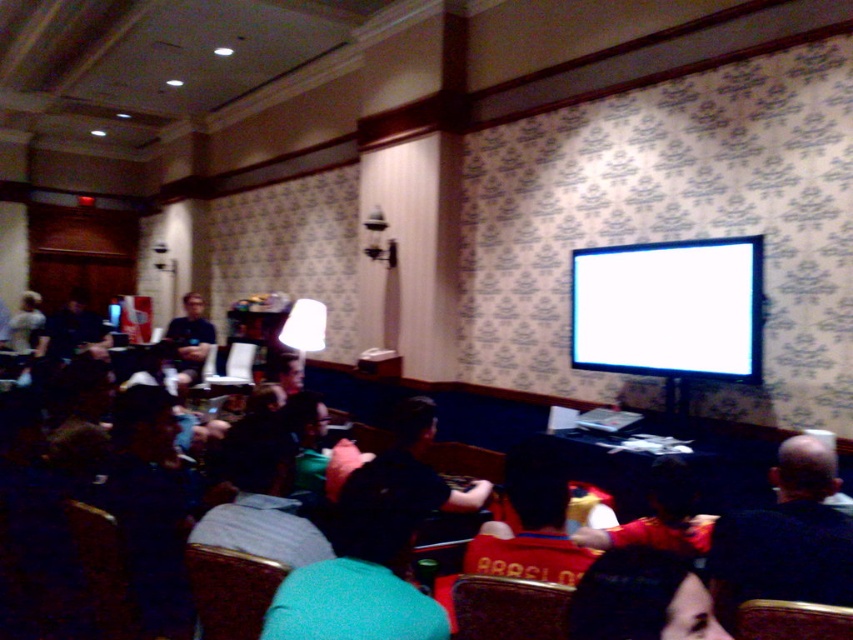
Consider the image. Can you confirm if dark blue shirt at center is taller than brown leather chair at lower right?

Indeed, dark blue shirt at center has a greater height compared to brown leather chair at lower right.

Is dark blue shirt at center wider than brown leather chair at lower right?

Indeed, dark blue shirt at center has a greater width compared to brown leather chair at lower right.

Which is in front, point (833, 458) or point (793, 604)?

Point (793, 604)

Where is `dark blue shirt at center`? dark blue shirt at center is located at coordinates (786, 538).

Between red fabric shirt at center and matte black shirt at center, which one appears on the left side from the viewer's perspective?

From the viewer's perspective, matte black shirt at center appears more on the left side.

Is point (567, 488) farther from camera compared to point (198, 294)?

No.

The width and height of the screenshot is (853, 640). What are the coordinates of `red fabric shirt at center` in the screenshot? It's located at (531, 522).

Between point (310, 572) and point (178, 339), which one is positioned in front?

Point (310, 572) is in front.

Between teal fabric shirt at center and matte black shirt at center, which one is positioned higher?

matte black shirt at center is above.

The height and width of the screenshot is (640, 853). I want to click on teal fabric shirt at center, so click(360, 572).